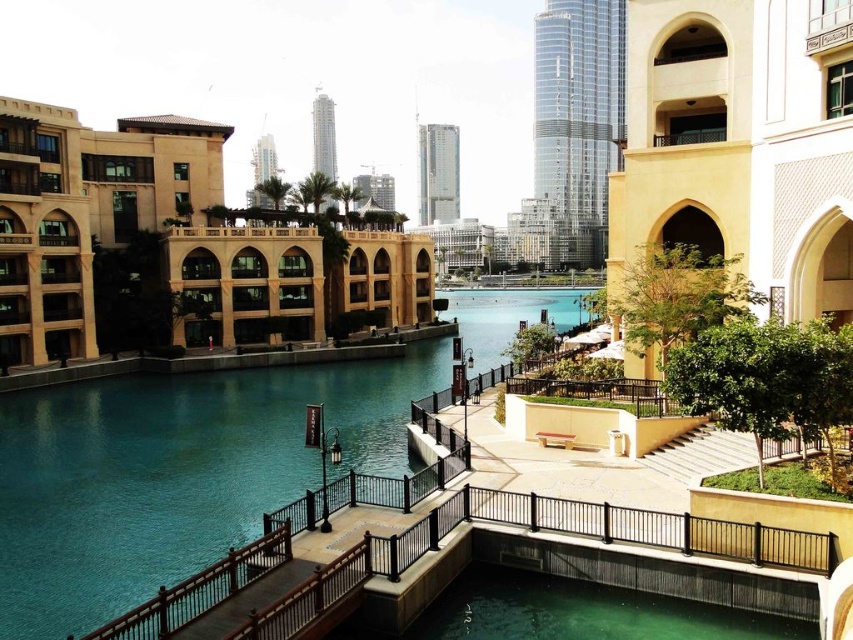
Image resolution: width=853 pixels, height=640 pixels. In order to click on teal glossy water at center in this screenshot , I will do `click(173, 474)`.

Is beige stucco building at center-right shorter than smooth glass skyscraper at center?

Yes, beige stucco building at center-right is shorter than smooth glass skyscraper at center.

Is beige stucco building at center-right to the right of smooth glass skyscraper at center from the viewer's perspective?

Yes, beige stucco building at center-right is to the right of smooth glass skyscraper at center.

I want to click on beige stucco building at center-right, so 741,145.

Does beige stucco building at center-right appear on the left side of beige stone building at left?

In fact, beige stucco building at center-right is to the right of beige stone building at left.

Does beige stucco building at center-right have a smaller size compared to beige stone building at left?

Actually, beige stucco building at center-right might be larger than beige stone building at left.

You are a GUI agent. You are given a task and a screenshot of the screen. Output one action in this format:
    pyautogui.click(x=<x>, y=<y>)
    Task: Click on the beige stucco building at center-right
    This screenshot has width=853, height=640.
    Given the screenshot: What is the action you would take?
    pyautogui.click(x=741, y=145)